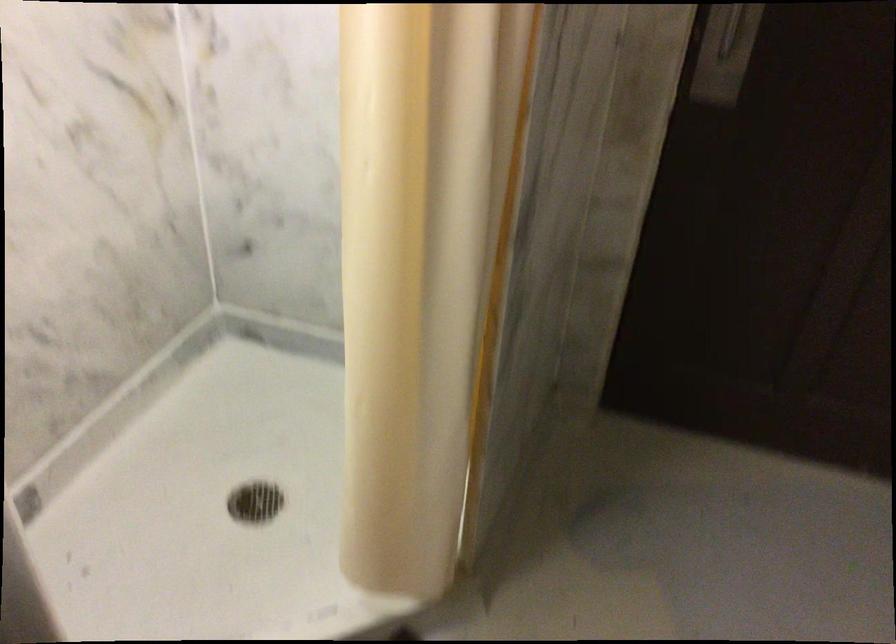
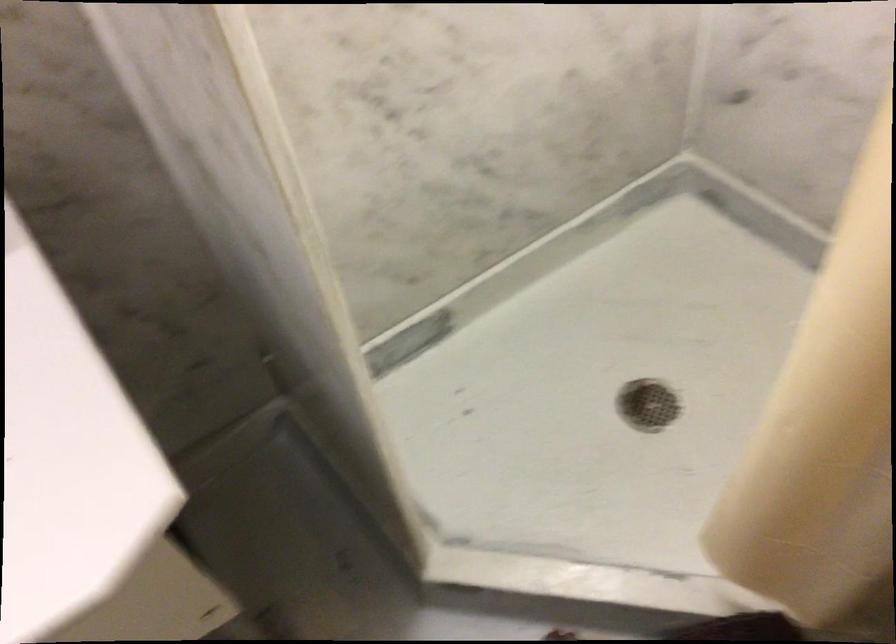
First-person continuous shooting, in which direction is the camera rotating?

The camera's rotation is toward left-down.